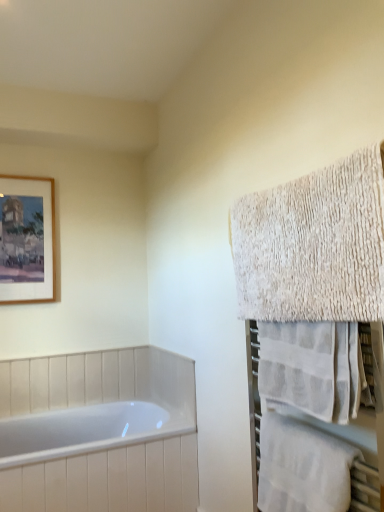
Measure the distance between wooden-framed painting at upper left and camera.

wooden-framed painting at upper left and camera are 2.37 meters apart from each other.

Measure the distance between white glossy bathtub at lower left and camera.

white glossy bathtub at lower left is 1.71 meters away from camera.

What are the coordinates of `white textured towel at right, which is the 2th towel in top-to-bottom order` in the screenshot? It's located at pos(312,367).

The image size is (384, 512). Describe the element at coordinates (313, 245) in the screenshot. I see `white textured towel at right, the third towel when ordered from bottom to top` at that location.

Where is `white textured towel at right, which is the 3th towel from top to bottom`? white textured towel at right, which is the 3th towel from top to bottom is located at coordinates (303, 467).

Identify the location of bathtub that is on the left side of white textured towel at right, which is the 2th towel in top-to-bottom order. Image resolution: width=384 pixels, height=512 pixels. (99, 432).

Is white glossy bathtub at lower left facing towards white textured towel at right, which is counted as the 2th towel, starting from the bottom?

No, white glossy bathtub at lower left is not aimed at white textured towel at right, which is counted as the 2th towel, starting from the bottom.

Is white textured towel at right, which is the 2th towel in top-to-bottom order, surrounded by white glossy bathtub at lower left?

No, white textured towel at right, which is the 2th towel in top-to-bottom order, is located outside of white glossy bathtub at lower left.

From the image's perspective, is wooden-framed painting at upper left under white textured towel at right, the 1th towel positioned from the bottom?

No.

Does wooden-framed painting at upper left touch white textured towel at right, the 1th towel positioned from the bottom?

No, wooden-framed painting at upper left is not touching white textured towel at right, the 1th towel positioned from the bottom.

From a real-world perspective, is wooden-framed painting at upper left positioned under white textured towel at right, the 1th towel positioned from the bottom, based on gravity?

No, from a real-world perspective, wooden-framed painting at upper left is not beneath white textured towel at right, the 1th towel positioned from the bottom.

Considering the relative sizes of wooden-framed painting at upper left and white textured towel at right, which is the 3th towel from top to bottom, in the image provided, is wooden-framed painting at upper left wider than white textured towel at right, which is the 3th towel from top to bottom,?

In fact, wooden-framed painting at upper left might be narrower than white textured towel at right, which is the 3th towel from top to bottom.

What's the angular difference between wooden-framed painting at upper left and white textured towel at right, positioned as the first towel in top-to-bottom order,'s facing directions?

They differ by 90.6 degrees in their facing directions.

How far apart are wooden-framed painting at upper left and white textured towel at right, the third towel when ordered from bottom to top?

wooden-framed painting at upper left and white textured towel at right, the third towel when ordered from bottom to top, are 1.63 meters apart from each other.

From the image's perspective, does wooden-framed painting at upper left appear higher than white textured towel at right, the third towel when ordered from bottom to top?

Correct, wooden-framed painting at upper left appears higher than white textured towel at right, the third towel when ordered from bottom to top, in the image.

From their relative heights in the image, would you say wooden-framed painting at upper left is taller or shorter than white textured towel at right, positioned as the first towel in top-to-bottom order?

Considering their sizes, wooden-framed painting at upper left has more height than white textured towel at right, positioned as the first towel in top-to-bottom order.

Does white textured towel at right, which is the 3th towel from top to bottom, have a greater width compared to white glossy bathtub at lower left?

In fact, white textured towel at right, which is the 3th towel from top to bottom, might be narrower than white glossy bathtub at lower left.

How far apart are white textured towel at right, which is the 3th towel from top to bottom, and white glossy bathtub at lower left?

white textured towel at right, which is the 3th towel from top to bottom, is 3.60 feet from white glossy bathtub at lower left.

Can you tell me how much white textured towel at right, the 1th towel positioned from the bottom, and white glossy bathtub at lower left differ in facing direction?

They differ by 90.3 degrees in their facing directions.

From a real-world perspective, is white textured towel at right, the 1th towel positioned from the bottom, below white glossy bathtub at lower left?

No, from a real-world perspective, white textured towel at right, the 1th towel positioned from the bottom, is not under white glossy bathtub at lower left.

Considering the relative sizes of white textured towel at right, the third towel when ordered from bottom to top, and white textured towel at right, which is the 2th towel in top-to-bottom order, in the image provided, is white textured towel at right, the third towel when ordered from bottom to top, bigger than white textured towel at right, which is the 2th towel in top-to-bottom order,?

Correct, white textured towel at right, the third towel when ordered from bottom to top, is larger in size than white textured towel at right, which is the 2th towel in top-to-bottom order.

From a real-world perspective, which object stands above the other?

In real-world perspective, white textured towel at right, positioned as the first towel in top-to-bottom order, is above.

Is white textured towel at right, positioned as the first towel in top-to-bottom order, wider or thinner than white textured towel at right, which is the 2th towel in top-to-bottom order?

white textured towel at right, positioned as the first towel in top-to-bottom order, is thinner than white textured towel at right, which is the 2th towel in top-to-bottom order.

Considering the sizes of objects white textured towel at right, positioned as the first towel in top-to-bottom order, and white textured towel at right, which is the 2th towel in top-to-bottom order, in the image provided, who is shorter, white textured towel at right, positioned as the first towel in top-to-bottom order, or white textured towel at right, which is the 2th towel in top-to-bottom order,?

white textured towel at right, which is the 2th towel in top-to-bottom order, is shorter.

Considering the relative sizes of white textured towel at right, which is the 2th towel in top-to-bottom order, and white textured towel at right, the third towel when ordered from bottom to top, in the image provided, is white textured towel at right, which is the 2th towel in top-to-bottom order, thinner than white textured towel at right, the third towel when ordered from bottom to top,?

No, white textured towel at right, which is the 2th towel in top-to-bottom order, is not thinner than white textured towel at right, the third towel when ordered from bottom to top.

What's the angular difference between white textured towel at right, which is the 2th towel in top-to-bottom order, and white textured towel at right, positioned as the first towel in top-to-bottom order,'s facing directions?

The angle between the facing direction of white textured towel at right, which is the 2th towel in top-to-bottom order, and the facing direction of white textured towel at right, positioned as the first towel in top-to-bottom order, is 0.00385 degrees.

Could you measure the distance between white textured towel at right, which is counted as the 2th towel, starting from the bottom, and white textured towel at right, the third towel when ordered from bottom to top?

The distance of white textured towel at right, which is counted as the 2th towel, starting from the bottom, from white textured towel at right, the third towel when ordered from bottom to top, is 6.63 inches.

Considering the relative positions of white textured towel at right, which is the 2th towel in top-to-bottom order, and white textured towel at right, positioned as the first towel in top-to-bottom order, in the image provided, is white textured towel at right, which is the 2th towel in top-to-bottom order, to the left of white textured towel at right, positioned as the first towel in top-to-bottom order, from the viewer's perspective?

In fact, white textured towel at right, which is the 2th towel in top-to-bottom order, is to the right of white textured towel at right, positioned as the first towel in top-to-bottom order.

From a real-world perspective, between white textured towel at right, which is the 3th towel from top to bottom, and wooden-framed painting at upper left, who is vertically lower?

In real-world perspective, white textured towel at right, which is the 3th towel from top to bottom, is lower.

From the image's perspective, between white textured towel at right, the 1th towel positioned from the bottom, and wooden-framed painting at upper left, which one is located above?

From the image's view, wooden-framed painting at upper left is above.

Considering the relative positions of white textured towel at right, which is the 3th towel from top to bottom, and wooden-framed painting at upper left in the image provided, is white textured towel at right, which is the 3th towel from top to bottom, in front of wooden-framed painting at upper left?

Yes, it is.

Starting from the wooden-framed painting at upper left, which towel is the 1st one in front? Please provide its 2D coordinates.

[(303, 467)]

Where is `towel that is the 2nd one when counting upward from the white glossy bathtub at lower left (from the image's perspective)`? This screenshot has width=384, height=512. towel that is the 2nd one when counting upward from the white glossy bathtub at lower left (from the image's perspective) is located at coordinates (312, 367).

Locate an element on the screen. This screenshot has width=384, height=512. picture frame located above the white textured towel at right, the 1th towel positioned from the bottom (from a real-world perspective) is located at coordinates (27, 239).

Which object lies nearer to the anchor point white glossy bathtub at lower left, wooden-framed painting at upper left or white textured towel at right, which is counted as the 2th towel, starting from the bottom?

The object closer to white glossy bathtub at lower left is wooden-framed painting at upper left.

When comparing their distances from white textured towel at right, the 1th towel positioned from the bottom, does white textured towel at right, positioned as the first towel in top-to-bottom order, or wooden-framed painting at upper left seem closer?

white textured towel at right, positioned as the first towel in top-to-bottom order, is closer to white textured towel at right, the 1th towel positioned from the bottom.

Considering their positions, is white textured towel at right, which is the 3th towel from top to bottom, positioned closer to white glossy bathtub at lower left than white textured towel at right, the third towel when ordered from bottom to top?

white textured towel at right, which is the 3th towel from top to bottom.

From the image, which object appears to be nearer to white textured towel at right, the 1th towel positioned from the bottom, white textured towel at right, which is counted as the 2th towel, starting from the bottom, or white glossy bathtub at lower left?

white textured towel at right, which is counted as the 2th towel, starting from the bottom.

Considering their positions, is white textured towel at right, the 1th towel positioned from the bottom, positioned further to white textured towel at right, which is the 2th towel in top-to-bottom order, than wooden-framed painting at upper left?

wooden-framed painting at upper left is further to white textured towel at right, which is the 2th towel in top-to-bottom order.

In the scene shown: Which object lies nearer to the anchor point white textured towel at right, the 1th towel positioned from the bottom, white glossy bathtub at lower left or white textured towel at right, positioned as the first towel in top-to-bottom order?

Based on the image, white textured towel at right, positioned as the first towel in top-to-bottom order, appears to be nearer to white textured towel at right, the 1th towel positioned from the bottom.

From the image, which object appears to be nearer to wooden-framed painting at upper left, white textured towel at right, which is the 3th towel from top to bottom, or white textured towel at right, the third towel when ordered from bottom to top?

Based on the image, white textured towel at right, the third towel when ordered from bottom to top, appears to be nearer to wooden-framed painting at upper left.

Considering their positions, is white glossy bathtub at lower left positioned further to white textured towel at right, positioned as the first towel in top-to-bottom order, than white textured towel at right, which is counted as the 2th towel, starting from the bottom?

white glossy bathtub at lower left lies further to white textured towel at right, positioned as the first towel in top-to-bottom order, than the other object.

I want to click on bathtub between white textured towel at right, which is counted as the 2th towel, starting from the bottom, and wooden-framed painting at upper left, along the z-axis, so click(99, 432).

Where is `bathtub positioned between white textured towel at right, which is the 3th towel from top to bottom, and wooden-framed painting at upper left from near to far`? The height and width of the screenshot is (512, 384). bathtub positioned between white textured towel at right, which is the 3th towel from top to bottom, and wooden-framed painting at upper left from near to far is located at coordinates (99, 432).

The width and height of the screenshot is (384, 512). Find the location of `bathtub positioned between white textured towel at right, the third towel when ordered from bottom to top, and wooden-framed painting at upper left from near to far`. bathtub positioned between white textured towel at right, the third towel when ordered from bottom to top, and wooden-framed painting at upper left from near to far is located at coordinates (99, 432).

Where is `towel that lies between white textured towel at right, the third towel when ordered from bottom to top, and white textured towel at right, the 1th towel positioned from the bottom, from top to bottom`? The image size is (384, 512). towel that lies between white textured towel at right, the third towel when ordered from bottom to top, and white textured towel at right, the 1th towel positioned from the bottom, from top to bottom is located at coordinates (312, 367).